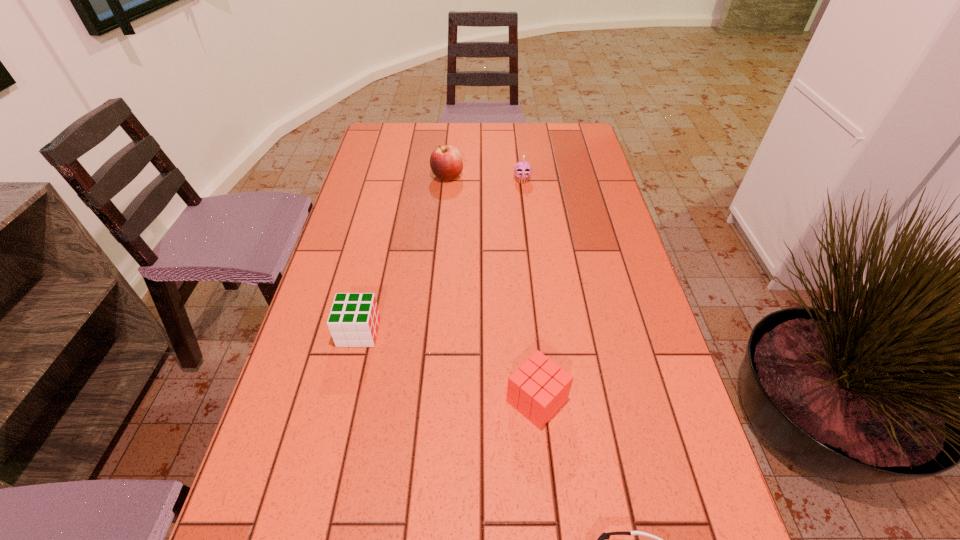
What are the coordinates of `the fourth object from right to left` in the screenshot? It's located at (446, 163).

The image size is (960, 540). I want to click on the tallest object, so click(446, 163).

Where is `cupcake`? cupcake is located at coordinates (522, 170).

Identify the location of the nearer cube. The height and width of the screenshot is (540, 960). pyautogui.click(x=539, y=388).

Identify the location of the right cube. (539, 388).

Find the location of a particular element. The width and height of the screenshot is (960, 540). the third farthest object is located at coordinates (353, 321).

Locate an element on the screen. the leftmost object is located at coordinates (353, 321).

Locate an element on the screen. Image resolution: width=960 pixels, height=540 pixels. vacant region located 0.140m on the front of the tallest object is located at coordinates (444, 213).

This screenshot has width=960, height=540. What are the coordinates of `vacant area situated on the face of the cupcake` in the screenshot? It's located at (531, 260).

The width and height of the screenshot is (960, 540). In order to click on vacant area situated on the left of the second nearest object in this screenshot , I will do `click(324, 401)`.